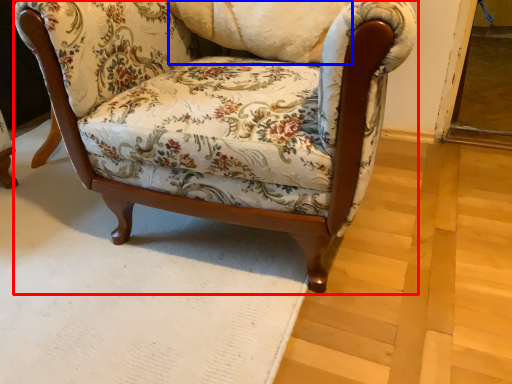
Question: Which object appears farthest to the camera in this image, chair (highlighted by a red box) or pillow (highlighted by a blue box)?

Choices:
 (A) chair
 (B) pillow

Answer: (B)